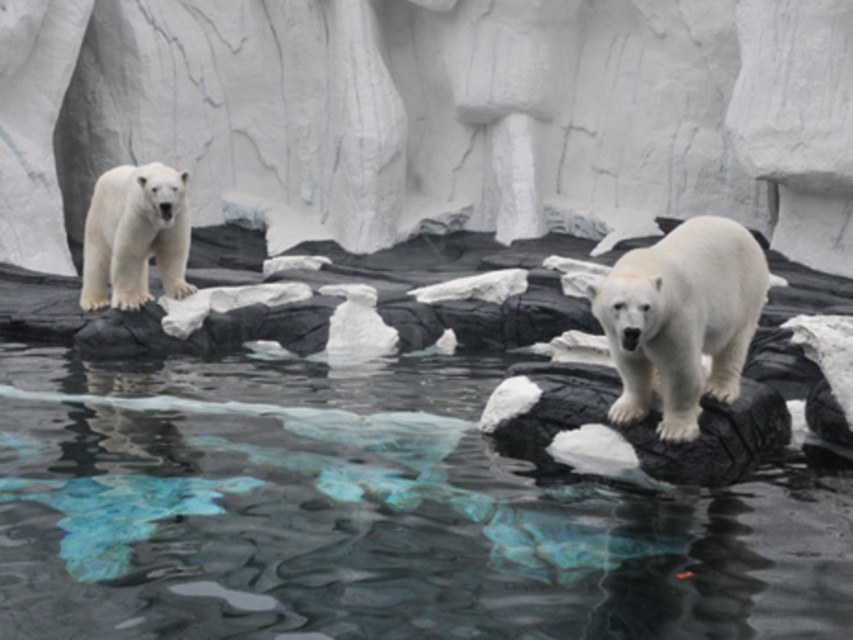
Question: Is white rubber tire at center wider than white fur polar bear at upper left?

Choices:
 (A) yes
 (B) no

Answer: (B)

Question: Which object appears farthest from the camera in this image?

Choices:
 (A) white fur polar bear at upper left
 (B) white ice at upper center
 (C) white rubber tire at center
 (D) white fur polar bear at center

Answer: (B)

Question: Is clear glass water at center positioned in front of white fur polar bear at upper left?

Choices:
 (A) no
 (B) yes

Answer: (B)

Question: Is clear glass water at center smaller than white fur polar bear at center?

Choices:
 (A) no
 (B) yes

Answer: (A)

Question: Among these points, which one is farthest from the camera?

Choices:
 (A) (830, 627)
 (B) (793, 145)

Answer: (B)

Question: Among these objects, which one is nearest to the camera?

Choices:
 (A) clear glass water at center
 (B) white ice at upper center

Answer: (A)